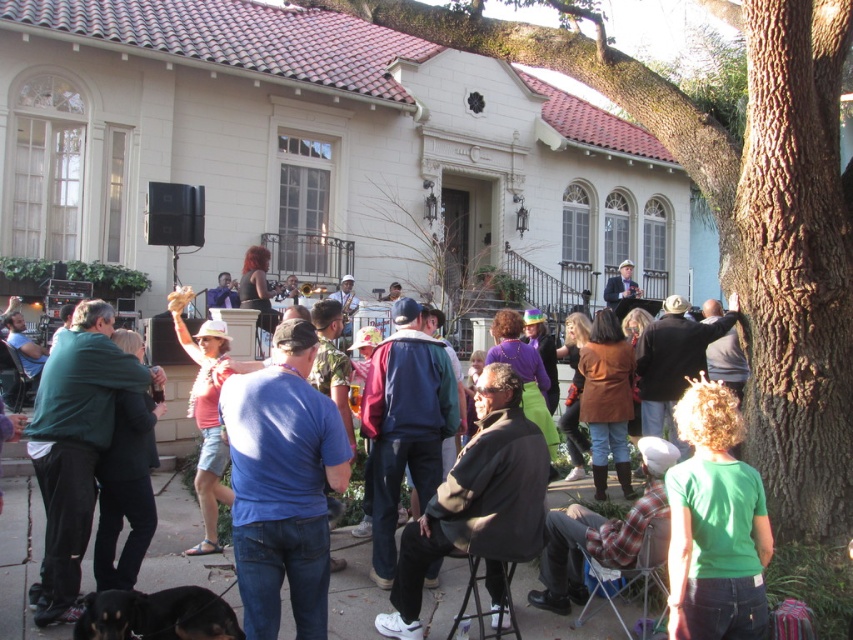
Question: Which object is closer to the camera taking this photo?

Choices:
 (A) matte blue shirt at center
 (B) brown rough bark tree at right

Answer: (B)

Question: In this image, where is green matte shirt at lower right located relative to flannel shirt at lower center?

Choices:
 (A) left
 (B) right

Answer: (B)

Question: Where is green matte shirt at lower right located in relation to flannel shirt at lower center in the image?

Choices:
 (A) below
 (B) above

Answer: (B)

Question: Which of the following is the farthest from the observer?

Choices:
 (A) (477, 500)
 (B) (727, 589)
 (C) (200, 452)
 (D) (805, 140)

Answer: (C)

Question: Estimate the real-world distances between objects in this image. Which object is farther from the dark brown leather jacket at center?

Choices:
 (A) pink fabric shirt at center
 (B) green matte jacket at left
 (C) brown rough bark tree at right
 (D) matte black jacket at center

Answer: (D)

Question: Is green matte jacket at left wider than flannel shirt at lower center?

Choices:
 (A) no
 (B) yes

Answer: (A)